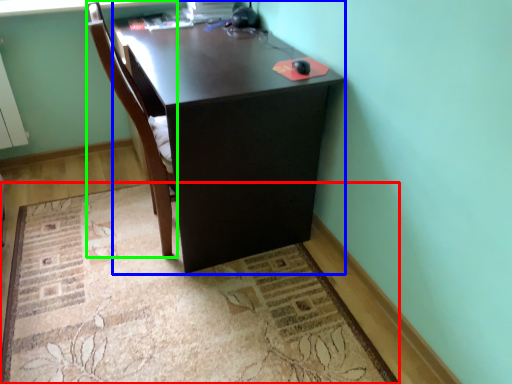
Question: Which object is positioned closest to mat (highlighted by a red box)? Select from desk (highlighted by a blue box) and chair (highlighted by a green box).

Choices:
 (A) desk
 (B) chair

Answer: (A)